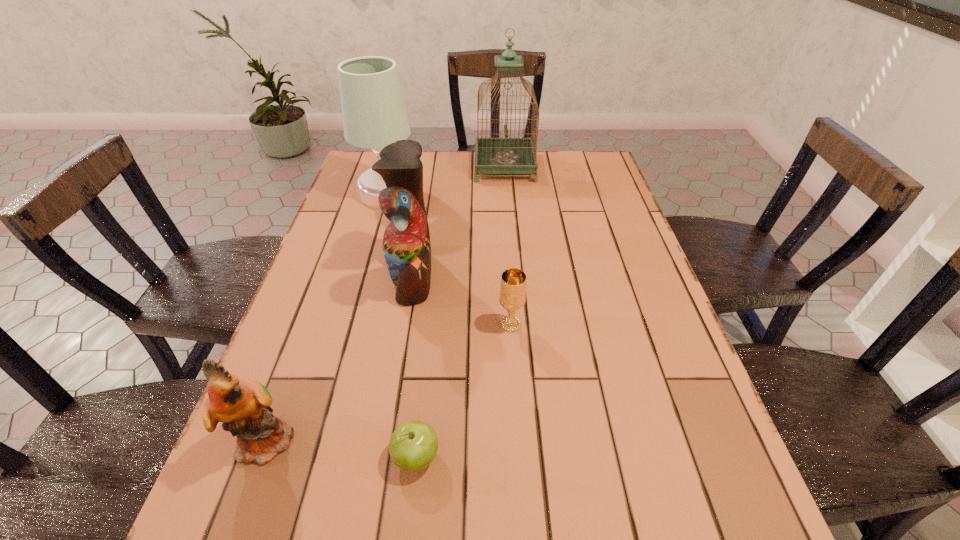
Image resolution: width=960 pixels, height=540 pixels. In order to click on blank space located 0.130m at the door of the birdcage in this screenshot , I will do `click(436, 167)`.

Locate an element on the screen. free space located at the door of the birdcage is located at coordinates (377, 167).

Find the location of `free space located on the base of the lampshade`. free space located on the base of the lampshade is located at coordinates (522, 193).

You are a GUI agent. You are given a task and a screenshot of the screen. Output one action in this format:
    pyautogui.click(x=<x>, y=<y>)
    Task: Click on the free location located 0.130m at the face of the farther parrot
    
    Given the screenshot: What is the action you would take?
    pyautogui.click(x=486, y=275)

This screenshot has height=540, width=960. I want to click on vacant area located on the front-facing side of the shorter parrot, so click(482, 440).

Locate an element on the screen. vacant space located on the front of the fifth tallest object is located at coordinates (515, 389).

What are the coordinates of `free space located 0.340m on the right of the shortest object` in the screenshot? It's located at (636, 457).

Find the location of a particular element. The image size is (960, 540). birdcage located in the far edge section of the desktop is located at coordinates (506, 155).

Where is `lampshade at the far edge`? The height and width of the screenshot is (540, 960). lampshade at the far edge is located at coordinates (374, 115).

At what (x,y) coordinates should I click in order to perform the action: click on lampshade situated at the left edge. Please return your answer as a coordinate pair (x, y). The image size is (960, 540). Looking at the image, I should click on (374, 115).